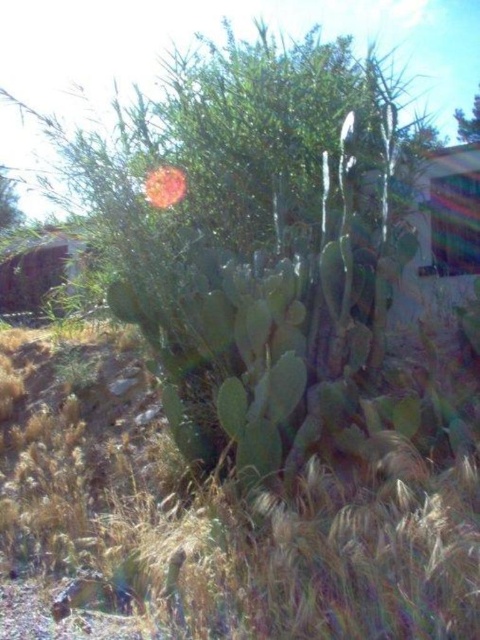
You are a gardener who wants to plant a new flower between the green grass at center and the smooth pink flower at center. Based on their positions, where should you place the new flower?

The green grass at center is located below the smooth pink flower at center, so you should place the new flower between them by positioning it above the green grass at center and below the smooth pink flower at center.

You are a gardener trying to plant a new flower in the desert. You have two options in the image, the green grass at center and the smooth pink flower at center. Which one has a wider base for planting?

The smooth pink flower at center has a wider base for planting since the green grass at center has a lesser width compared to smooth pink flower at center.